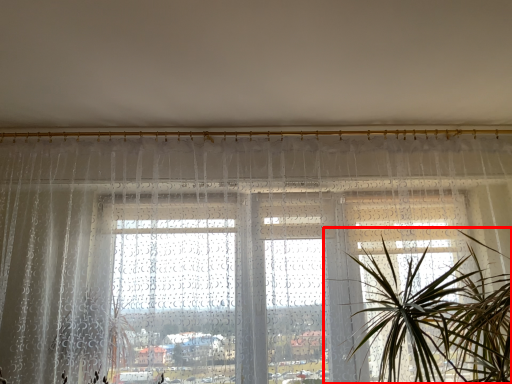
Question: From the image's perspective, where is houseplant (annotated by the red box) located relative to window?

Choices:
 (A) below
 (B) above

Answer: (A)